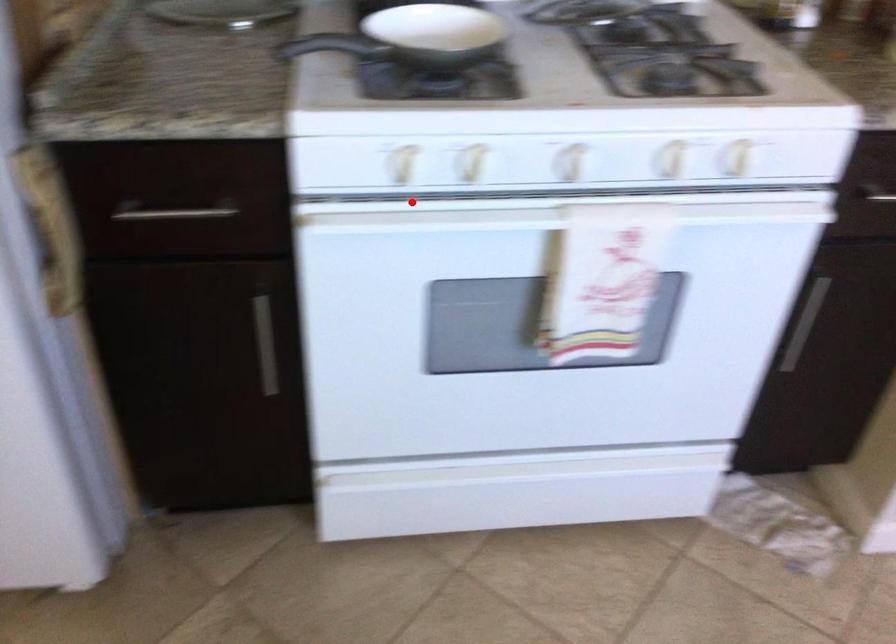
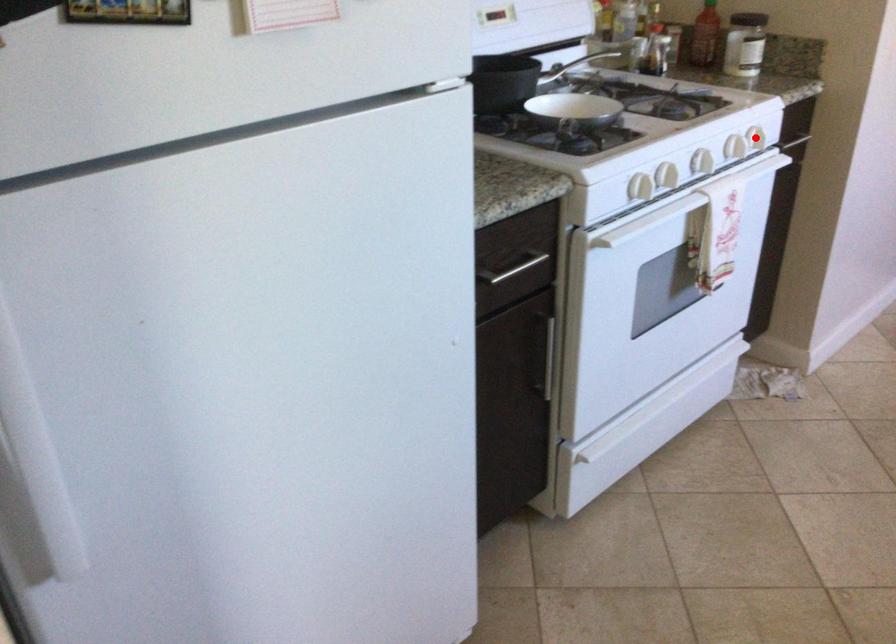
I am providing you with two images of the same scene from different viewpoints. A red point is marked on the first image and another point is marked on the second image. Do the highlighted points in image1 and image2 indicate the same real-world spot?

No